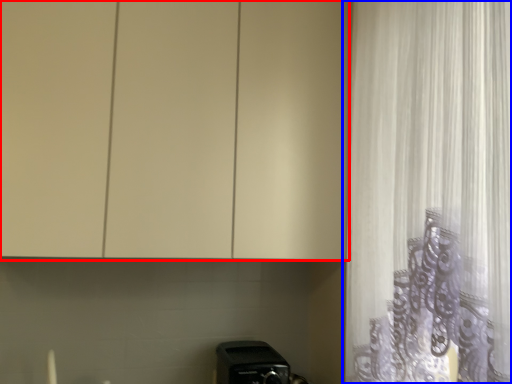
Question: Which point is closer to the camera, cabinetry (highlighted by a red box) or curtain (highlighted by a blue box)?

Choices:
 (A) cabinetry
 (B) curtain

Answer: (B)